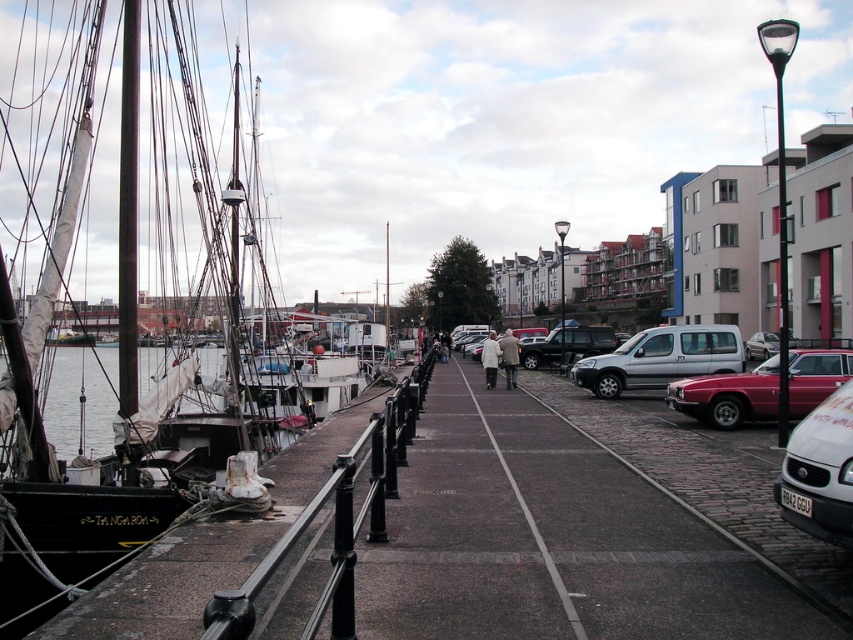
Is silver metallic van at center above white matte van at right?

No.

What are the coordinates of `silver metallic van at center` in the screenshot? It's located at click(x=819, y=456).

Is point (608, 541) in front of point (128, 195)?

Yes.

Between smooth dark wood dock at left and rusty metal mast at left, which one is positioned lower?

smooth dark wood dock at left is below.

At what (x,y) coordinates should I click in order to perform the action: click on smooth dark wood dock at left. Please return your answer as a coordinate pair (x, y). This screenshot has height=640, width=853. Looking at the image, I should click on (549, 538).

In the scene shown: Which is more to the left, smooth dark wood dock at left or metallic red sedan at right?

From the viewer's perspective, smooth dark wood dock at left appears more on the left side.

Is the position of smooth dark wood dock at left more distant than that of metallic red sedan at right?

No, smooth dark wood dock at left is in front of metallic red sedan at right.

Between point (418, 593) and point (801, 355), which one is positioned in front?

Point (418, 593) is more forward.

The image size is (853, 640). Find the location of `smooth dark wood dock at left`. smooth dark wood dock at left is located at coordinates (549, 538).